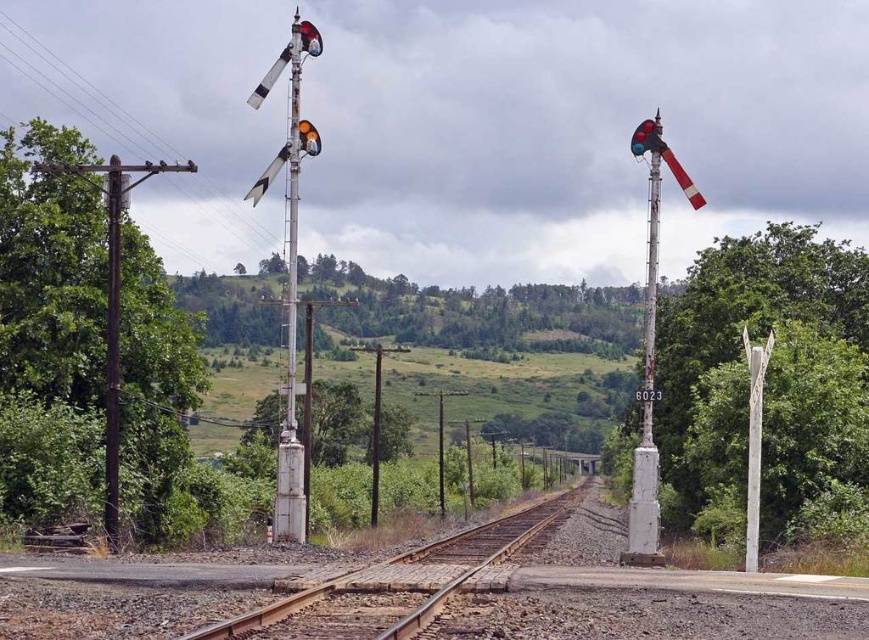
Who is higher up, metallic orange traffic light at center or metallic signal light at upper left?

→ metallic signal light at upper left

Between point (303, 122) and point (302, 24), which one is positioned in front?

Point (302, 24) is in front.

Locate an element on the screen. metallic orange traffic light at center is located at coordinates (308, 138).

Does point (493, 545) lie behind point (309, 129)?

Yes, point (493, 545) is farther from viewer.

Where is `brown gravel train track at center`? brown gravel train track at center is located at coordinates (400, 582).

Can you confirm if smooth white pole at left is shorter than metallic orange traffic light at center?

Incorrect, smooth white pole at left's height does not fall short of metallic orange traffic light at center's.

From the picture: Is smooth white pole at left thinner than metallic orange traffic light at center?

No.

Is point (110, 362) in front of point (314, 138)?

No.

Locate an element on the screen. The width and height of the screenshot is (869, 640). smooth white pole at left is located at coordinates (111, 346).